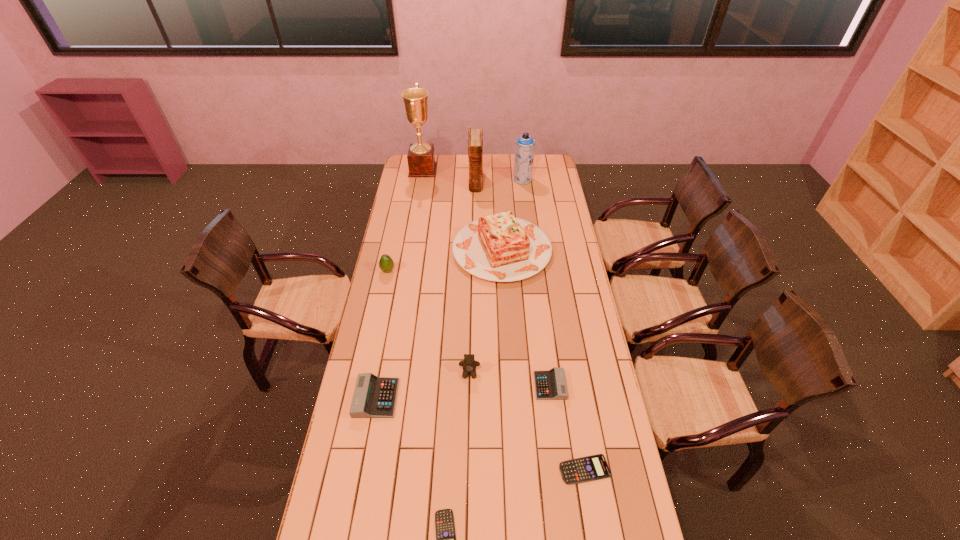
Where is `empty space between the avocado and the second tallest calculator`? This screenshot has width=960, height=540. empty space between the avocado and the second tallest calculator is located at coordinates (468, 328).

The image size is (960, 540). In order to click on empty space that is in between the brown teddy bear and the right blue calculator in this screenshot , I will do `click(527, 421)`.

Image resolution: width=960 pixels, height=540 pixels. Find the location of `free area in between the left gray calculator and the orange lasagna`. free area in between the left gray calculator and the orange lasagna is located at coordinates (439, 324).

This screenshot has height=540, width=960. I want to click on object that is the eighth closest to the tallest object, so click(x=589, y=468).

Find the location of a particular element. The width and height of the screenshot is (960, 540). the fifth closest object relative to the third tallest calculator is located at coordinates click(x=500, y=247).

Identify which calculator is the third closest to the hardback book. Please provide its 2D coordinates. Your answer should be formatted as a tuple, i.e. [(x, y)], where the tuple contains the x and y coordinates of a point satisfying the conditions above.

[(589, 468)]

Locate an element on the screen. This screenshot has height=540, width=960. the third closest calculator relative to the second tallest calculator is located at coordinates (374, 397).

This screenshot has width=960, height=540. Identify the location of free space that satisfies the following two spatial constraints: 1. on the back side of the bigger gray calculator; 2. on the right side of the aerosol can. (417, 179).

Where is `vacant region that satisfies the following two spatial constraints: 1. on the front side of the second shortest calculator; 2. on the left side of the right gray calculator`? Image resolution: width=960 pixels, height=540 pixels. vacant region that satisfies the following two spatial constraints: 1. on the front side of the second shortest calculator; 2. on the left side of the right gray calculator is located at coordinates (561, 469).

This screenshot has width=960, height=540. I want to click on free location that satisfies the following two spatial constraints: 1. on the front side of the seventh shortest object; 2. on the left side of the right gray calculator, so click(509, 386).